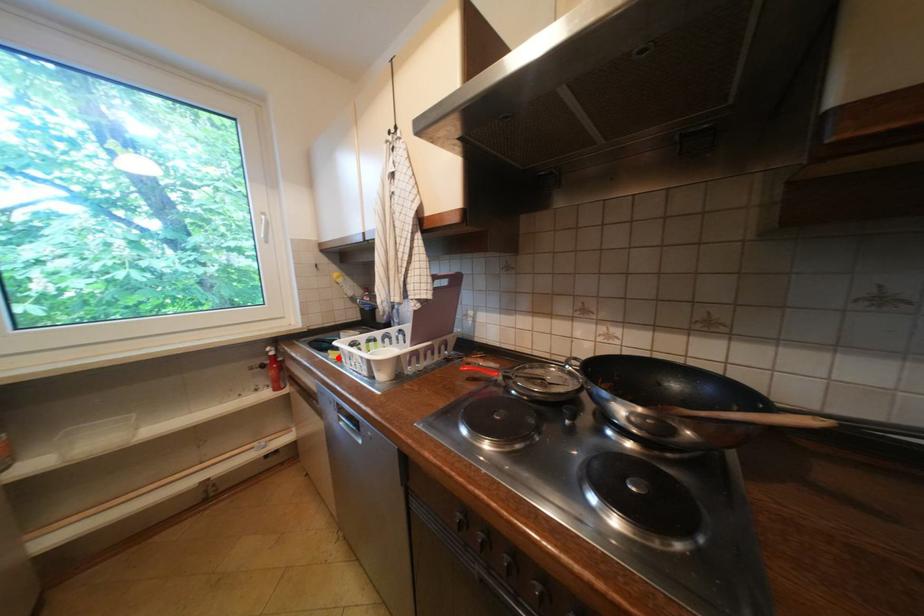
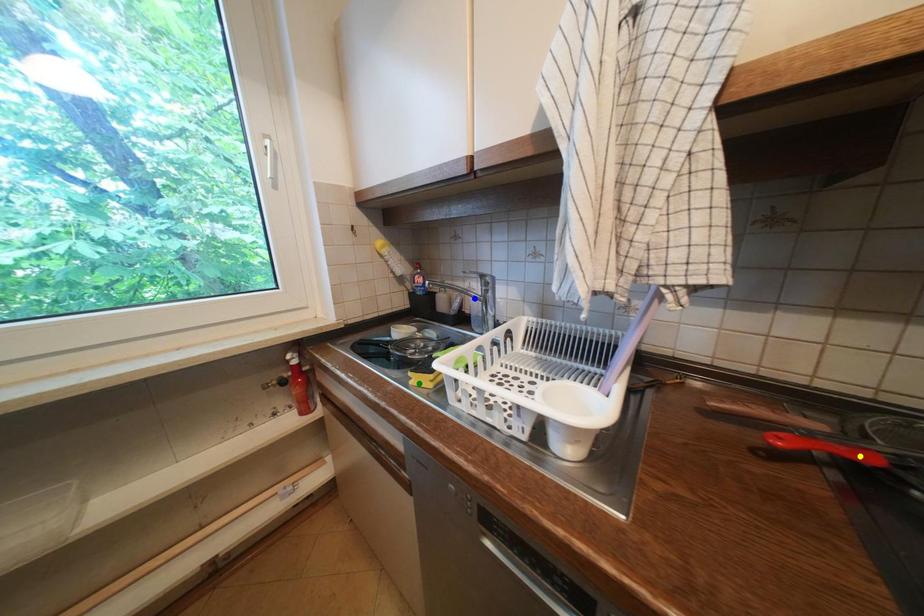
Question: I am providing you with two images of the same scene from different viewpoints. A red point is marked on the first image. You are given multiple points on the second image. Which point in image 2 represents the same 3d spot as the red point in image 1?

Choices:
 (A) green point
 (B) yellow point
 (C) blue point

Answer: (A)